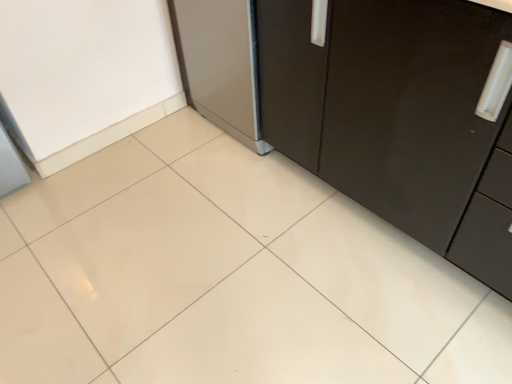
Question: From a real-world perspective, is matte black cabinet at center located higher than satin silver refrigerator at center?

Choices:
 (A) no
 (B) yes

Answer: (B)

Question: Does matte black cabinet at center come in front of satin silver refrigerator at center?

Choices:
 (A) yes
 (B) no

Answer: (A)

Question: Considering the relative sizes of matte black cabinet at center and satin silver refrigerator at center in the image provided, is matte black cabinet at center bigger than satin silver refrigerator at center?

Choices:
 (A) yes
 (B) no

Answer: (A)

Question: Is matte black cabinet at center at the left side of satin silver refrigerator at center?

Choices:
 (A) yes
 (B) no

Answer: (B)

Question: Considering the relative sizes of matte black cabinet at center and satin silver refrigerator at center in the image provided, is matte black cabinet at center smaller than satin silver refrigerator at center?

Choices:
 (A) yes
 (B) no

Answer: (B)

Question: Is the depth of matte black cabinet at center greater than that of satin silver refrigerator at center?

Choices:
 (A) no
 (B) yes

Answer: (A)

Question: Considering the relative sizes of satin silver refrigerator at center and matte black cabinet at center in the image provided, is satin silver refrigerator at center thinner than matte black cabinet at center?

Choices:
 (A) no
 (B) yes

Answer: (B)

Question: Is satin silver refrigerator at center outside of matte black cabinet at center?

Choices:
 (A) yes
 (B) no

Answer: (A)

Question: From the image's perspective, is satin silver refrigerator at center under matte black cabinet at center?

Choices:
 (A) yes
 (B) no

Answer: (B)

Question: Is satin silver refrigerator at center smaller than matte black cabinet at center?

Choices:
 (A) yes
 (B) no

Answer: (A)

Question: Can you confirm if satin silver refrigerator at center is taller than matte black cabinet at center?

Choices:
 (A) no
 (B) yes

Answer: (A)

Question: Is matte black cabinet at center at the back of satin silver refrigerator at center?

Choices:
 (A) no
 (B) yes

Answer: (A)

Question: Considering the positions of matte black cabinet at center and satin silver refrigerator at center in the image, is matte black cabinet at center taller or shorter than satin silver refrigerator at center?

Choices:
 (A) tall
 (B) short

Answer: (A)